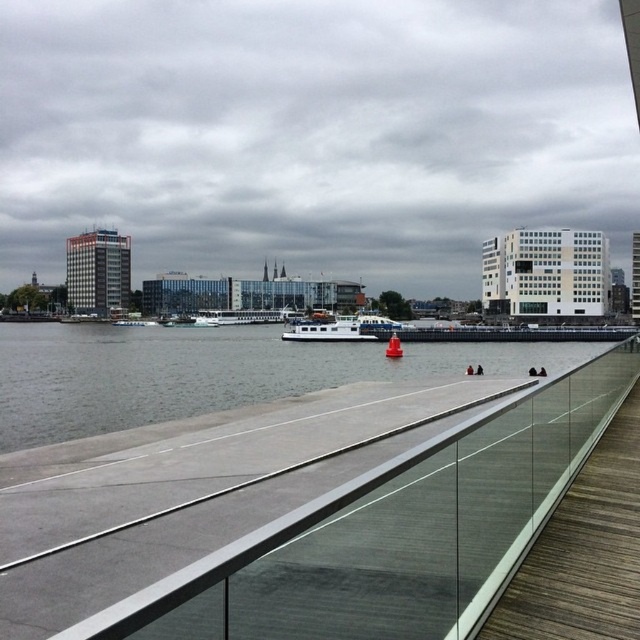
Looking at this image, does gray concrete river at center have a greater height compared to white matte boat at center?

No, gray concrete river at center is not taller than white matte boat at center.

Between gray concrete river at center and white matte boat at center, which one is positioned lower?

Positioned lower is gray concrete river at center.

Locate an element on the screen. The height and width of the screenshot is (640, 640). gray concrete river at center is located at coordinates (208, 372).